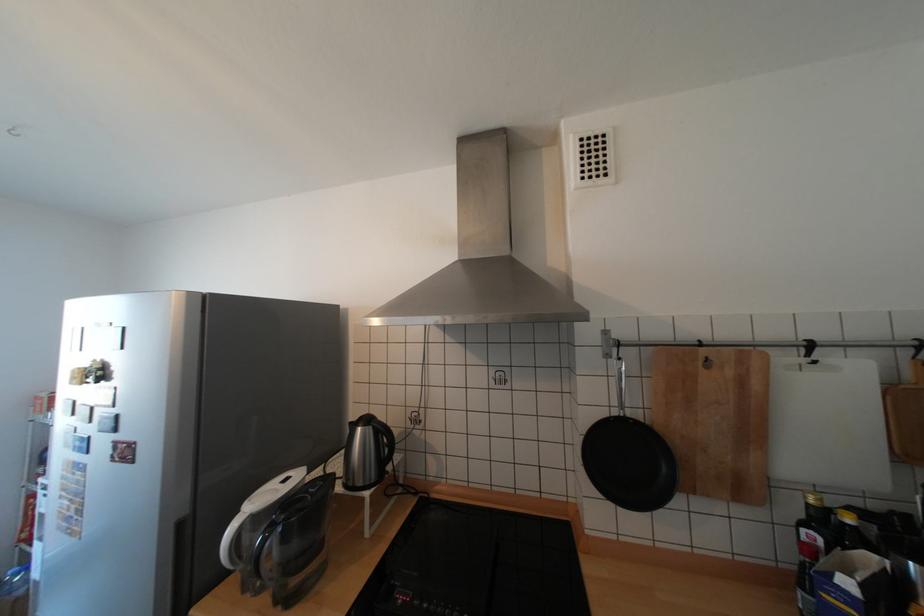
What do you see at coordinates (262, 546) in the screenshot? The image size is (924, 616). I see `a water bottle handle` at bounding box center [262, 546].